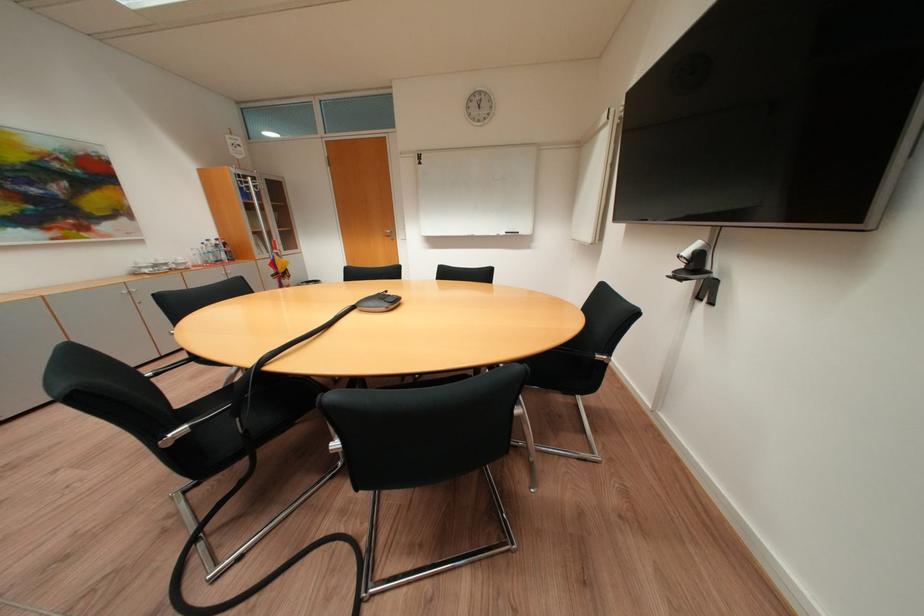
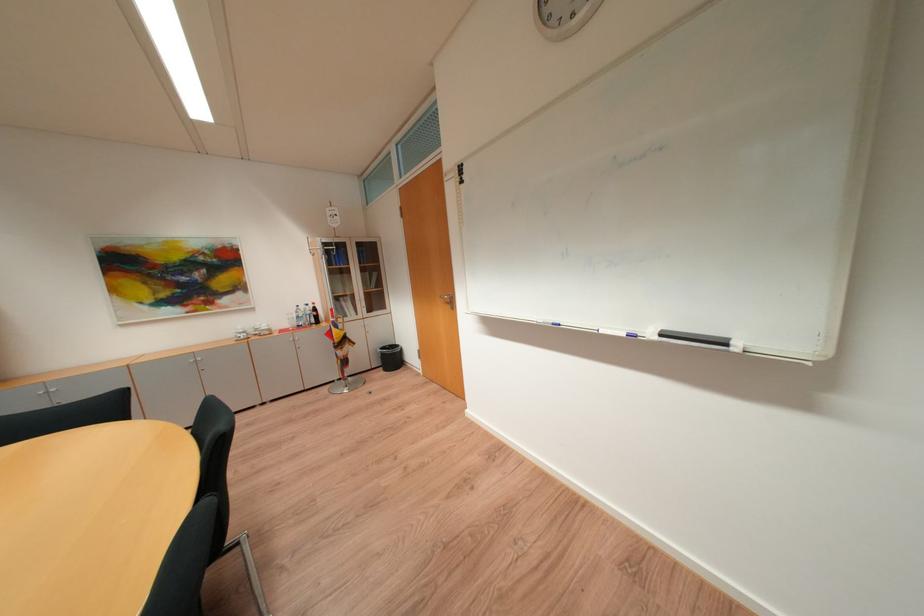
Where in the second image is the point corresponding to the point at 164,267 from the first image?

(264, 331)